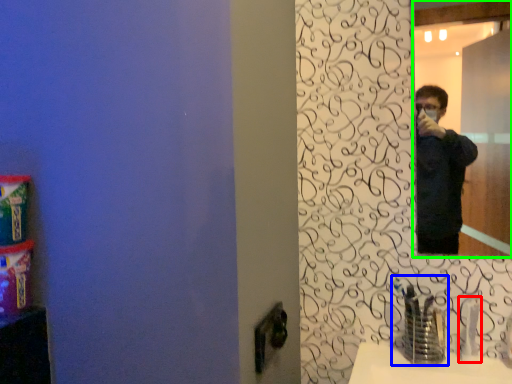
Question: Estimate the real-world distances between objects in this image. Which object is closer to faucet (highlighted by a red box), faucet (highlighted by a blue box) or mirror (highlighted by a green box)?

Choices:
 (A) faucet
 (B) mirror

Answer: (A)